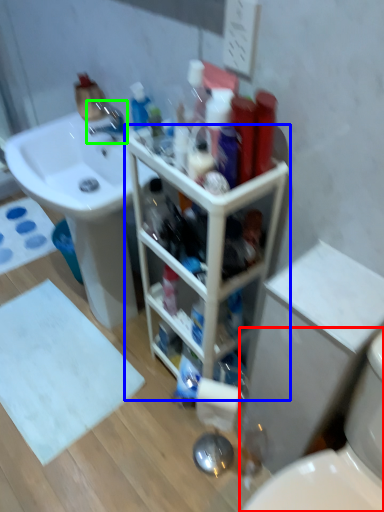
Question: Which object is positioned farthest from toilet (highlighted by a red box)? Select from bathroom cabinet (highlighted by a blue box) and tap (highlighted by a green box).

Choices:
 (A) bathroom cabinet
 (B) tap

Answer: (B)